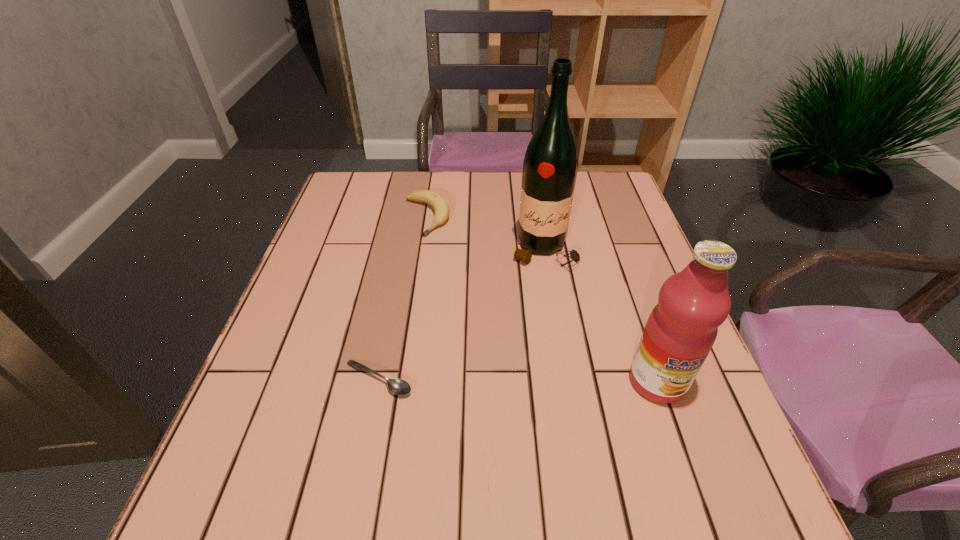
I want to click on vacant space on the desktop that is between the soupspoon and the fruit juice and is positioned at the stem of the second shortest object, so click(x=522, y=380).

What are the coordinates of `vacant space on the desktop that is between the soupspoon and the rightmost object and is positioned on the surface of the second object from right to left` in the screenshot? It's located at (553, 380).